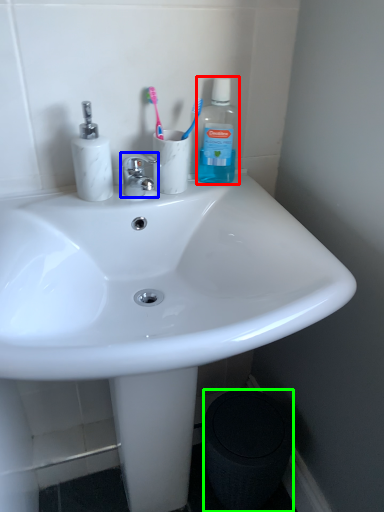
Question: Which object is positioned closest to bottle (highlighted by a red box)? Select from faucet (highlighted by a blue box) and trash bin/can (highlighted by a green box).

Choices:
 (A) faucet
 (B) trash bin/can

Answer: (A)